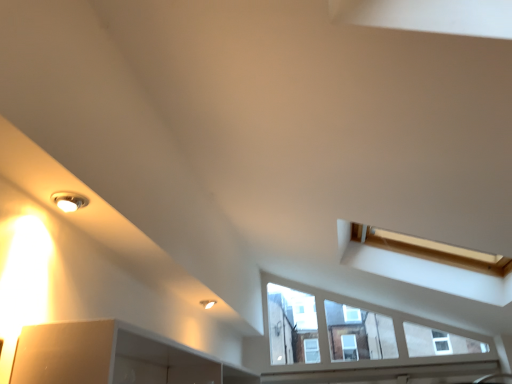
Question: Is matte white light fixture at upper left, acting as the second light fixture starting from the front, positioned behind white painted wood at lower center?

Choices:
 (A) yes
 (B) no

Answer: (B)

Question: Considering the relative sizes of matte white light fixture at upper left, the first light fixture ordered from the bottom, and white painted wood at lower center in the image provided, is matte white light fixture at upper left, the first light fixture ordered from the bottom, shorter than white painted wood at lower center?

Choices:
 (A) no
 (B) yes

Answer: (B)

Question: Considering the relative sizes of matte white light fixture at upper left, the first light fixture ordered from the bottom, and white painted wood at lower center in the image provided, is matte white light fixture at upper left, the first light fixture ordered from the bottom, thinner than white painted wood at lower center?

Choices:
 (A) no
 (B) yes

Answer: (A)

Question: Does matte white light fixture at upper left, placed as the 2th light fixture when sorted from top to bottom, have a greater width compared to white painted wood at lower center?

Choices:
 (A) yes
 (B) no

Answer: (A)

Question: Is matte white light fixture at upper left, the first light fixture ordered from the bottom, positioned far away from white painted wood at lower center?

Choices:
 (A) yes
 (B) no

Answer: (A)

Question: From a real-world perspective, is matte white light fixture at upper left, placed as the 2th light fixture when sorted from top to bottom, below white painted wood at lower center?

Choices:
 (A) no
 (B) yes

Answer: (A)

Question: Is matte silver light fixture at upper left, marked as the 1th light fixture in a front-to-back arrangement, at the back of matte white light fixture at upper left, acting as the second light fixture starting from the front?

Choices:
 (A) no
 (B) yes

Answer: (A)

Question: Is matte white light fixture at upper left, arranged as the 1th light fixture when viewed from the back, wider than matte silver light fixture at upper left, arranged as the 2th light fixture when viewed from the right?

Choices:
 (A) no
 (B) yes

Answer: (B)

Question: Does matte white light fixture at upper left, arranged as the 1th light fixture when viewed from the back, have a lesser height compared to matte silver light fixture at upper left, which is counted as the first light fixture, starting from the left?

Choices:
 (A) no
 (B) yes

Answer: (A)

Question: Does matte white light fixture at upper left, arranged as the 1th light fixture when viewed from the back, have a smaller size compared to matte silver light fixture at upper left, the second light fixture when ordered from bottom to top?

Choices:
 (A) yes
 (B) no

Answer: (B)

Question: Does matte white light fixture at upper left, placed as the 2th light fixture when sorted from top to bottom, have a lesser width compared to matte silver light fixture at upper left, arranged as the 2th light fixture when viewed from the right?

Choices:
 (A) no
 (B) yes

Answer: (A)

Question: Can you see matte white light fixture at upper left, which ranks as the 1th light fixture in right-to-left order, touching matte silver light fixture at upper left, arranged as the 2th light fixture when viewed from the right?

Choices:
 (A) no
 (B) yes

Answer: (A)

Question: Is matte silver light fixture at upper left, marked as the 1th light fixture in a front-to-back arrangement, not within matte white light fixture at upper left, the second light fixture viewed from the left?

Choices:
 (A) no
 (B) yes

Answer: (B)